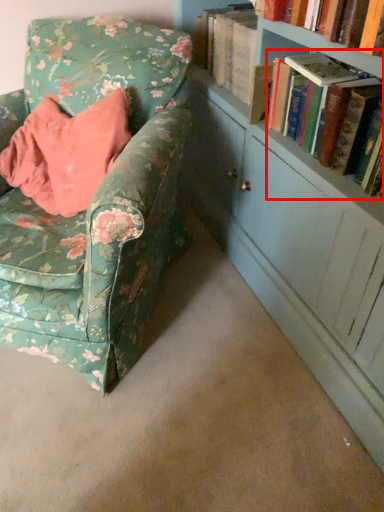
Question: From the image's perspective, where is book (annotated by the red box) located relative to chair?

Choices:
 (A) below
 (B) above

Answer: (B)